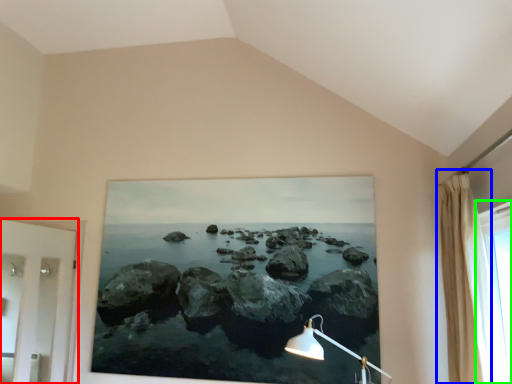
Question: Which is nearer to the door (highlighted by a red box)? curtain (highlighted by a blue box) or window (highlighted by a green box).

Choices:
 (A) curtain
 (B) window

Answer: (A)